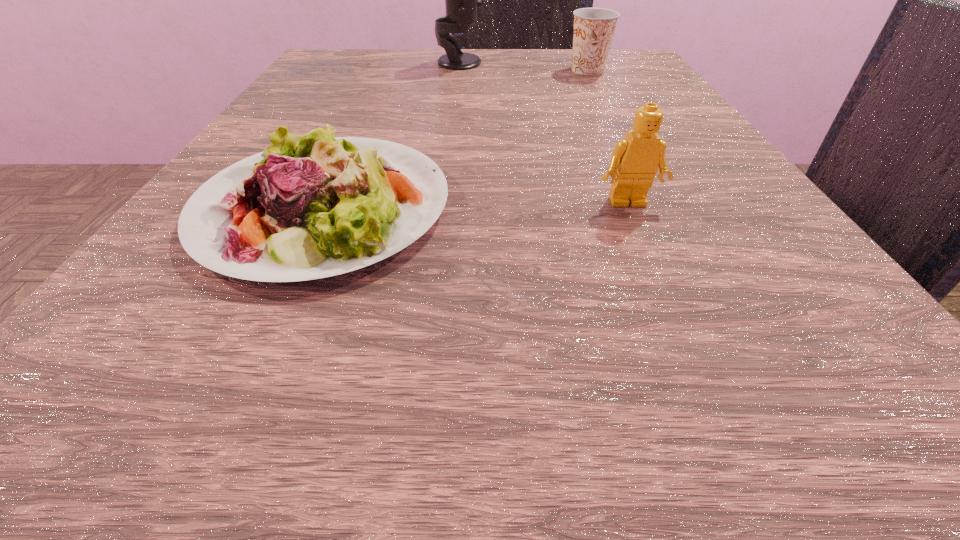
Image resolution: width=960 pixels, height=540 pixels. I want to click on vacant space in between the tallest object and the Lego, so click(543, 133).

Image resolution: width=960 pixels, height=540 pixels. Identify the location of object that ranks as the third closest to the third tallest object. (635, 160).

Image resolution: width=960 pixels, height=540 pixels. I want to click on object that stands as the third closest to the Lego, so click(462, 0).

Locate an element on the screen. Image resolution: width=960 pixels, height=540 pixels. vacant point that satisfies the following two spatial constraints: 1. on the back side of the salad plate; 2. on the left side of the third tallest object is located at coordinates (386, 70).

The image size is (960, 540). I want to click on free region that satisfies the following two spatial constraints: 1. on the front side of the Dixie cup; 2. on the left side of the tallest object, so click(458, 70).